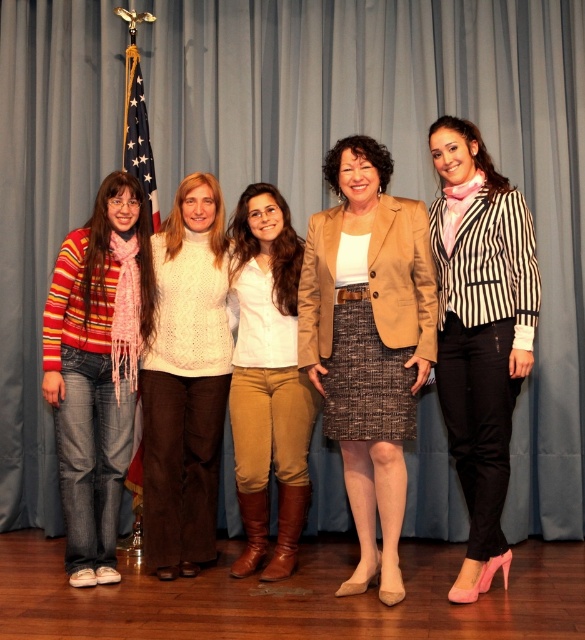
Is brown textured blazer at center positioned in front of striped fabric blazer at right?

Yes, it is.

Who is shorter, brown textured blazer at center or striped fabric blazer at right?

brown textured blazer at center is shorter.

Is point (391, 228) positioned in front of point (524, 278)?

No.

Identify the location of brown textured blazer at center. Image resolution: width=585 pixels, height=640 pixels. (369, 340).

Measure the distance between brown textured blazer at center and light brown leather boots at center.

brown textured blazer at center and light brown leather boots at center are 13.93 inches apart from each other.

Looking at this image, who is more forward, (388, 600) or (263, 429)?

Point (388, 600) is in front.

At what (x,y) coordinates should I click in order to perform the action: click on brown textured blazer at center. Please return your answer as a coordinate pair (x, y). Image resolution: width=585 pixels, height=640 pixels. Looking at the image, I should click on (369, 340).

Is striped fabric blazer at right bigger than light brown leather boots at center?

Yes, striped fabric blazer at right is bigger than light brown leather boots at center.

Is point (445, 422) behind point (266, 460)?

Yes, it is.

Is point (490, 240) behind point (270, 307)?

That is False.

The width and height of the screenshot is (585, 640). I want to click on striped fabric blazer at right, so click(x=480, y=332).